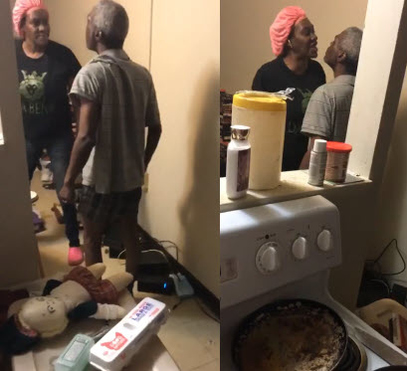
Identify the location of frying pan. The image size is (407, 371). (313, 306), (317, 342).